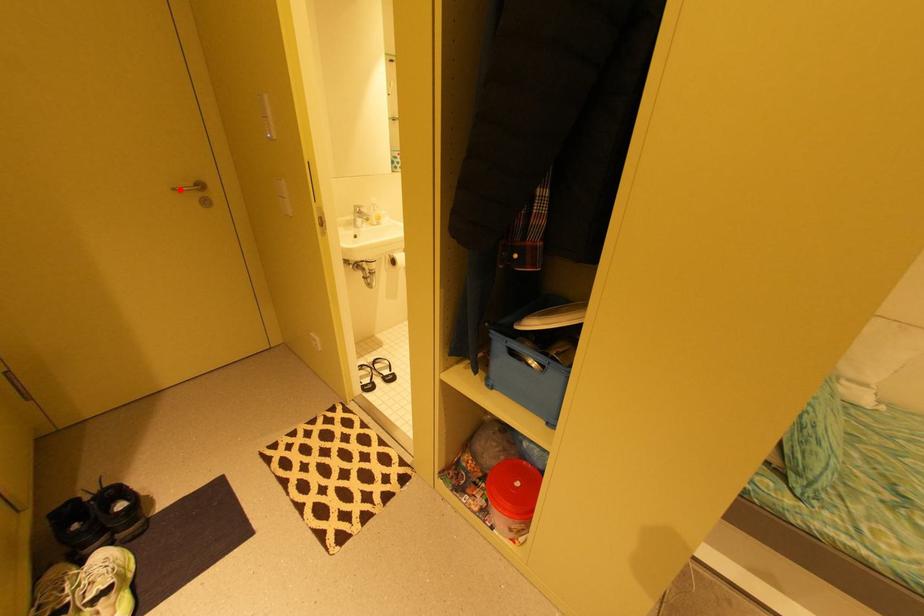
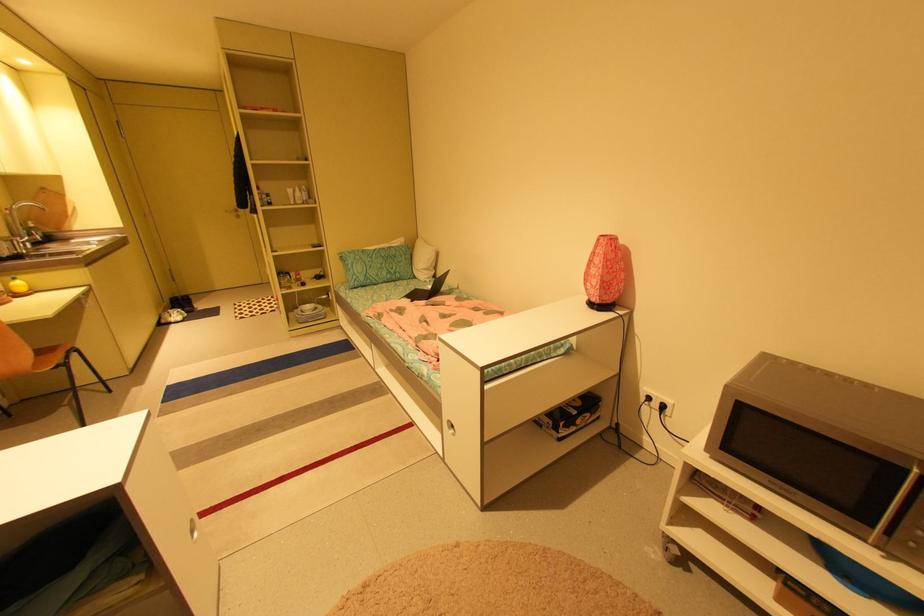
Question: I am providing you with two images of the same scene from different viewpoints. A red point is marked on the first image. At the location where the point appears in image 1, is it still visible in image 2?

Choices:
 (A) Yes
 (B) No

Answer: (A)